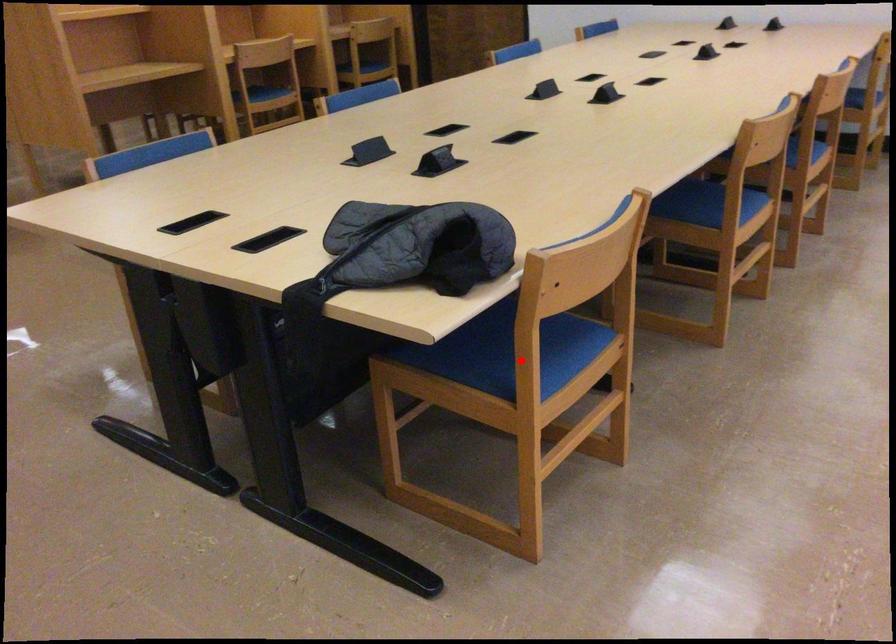
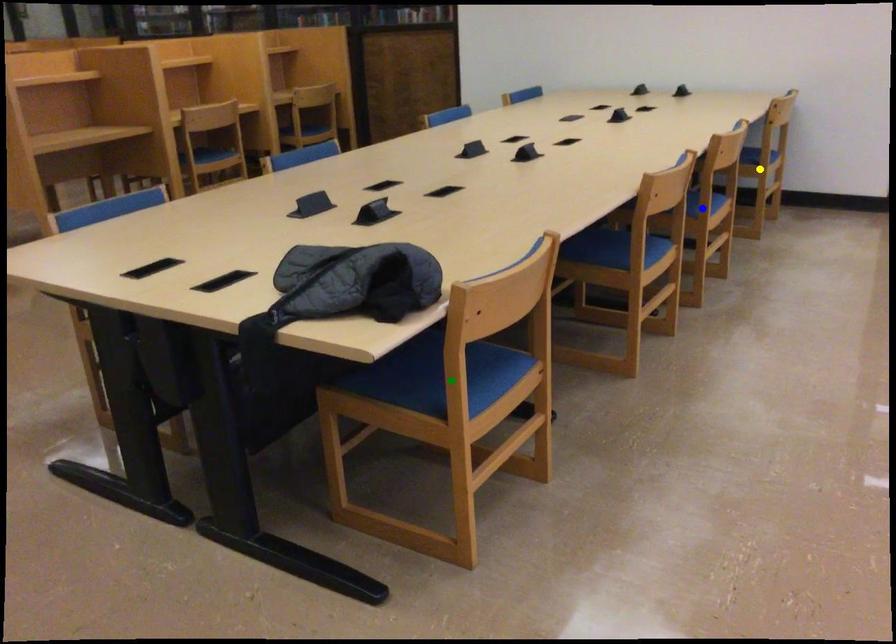
Question: I am providing you with two images of the same scene from different viewpoints. A red point is marked on the first image. You are given multiple points on the second image. Which point in image 2 is actually the same real-world point as the red point in image 1?

Choices:
 (A) blue point
 (B) yellow point
 (C) green point

Answer: (C)